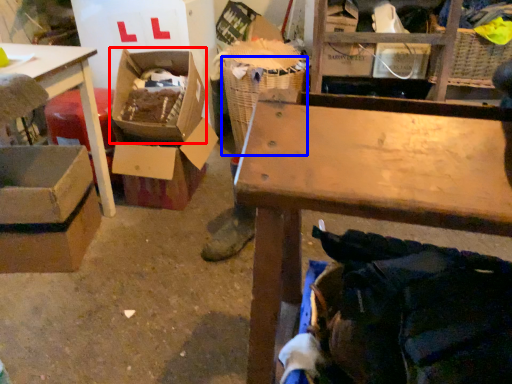
Question: Which of the following is the closest to the observer, storage box (highlighted by a red box) or laundry basket (highlighted by a blue box)?

Choices:
 (A) storage box
 (B) laundry basket

Answer: (A)